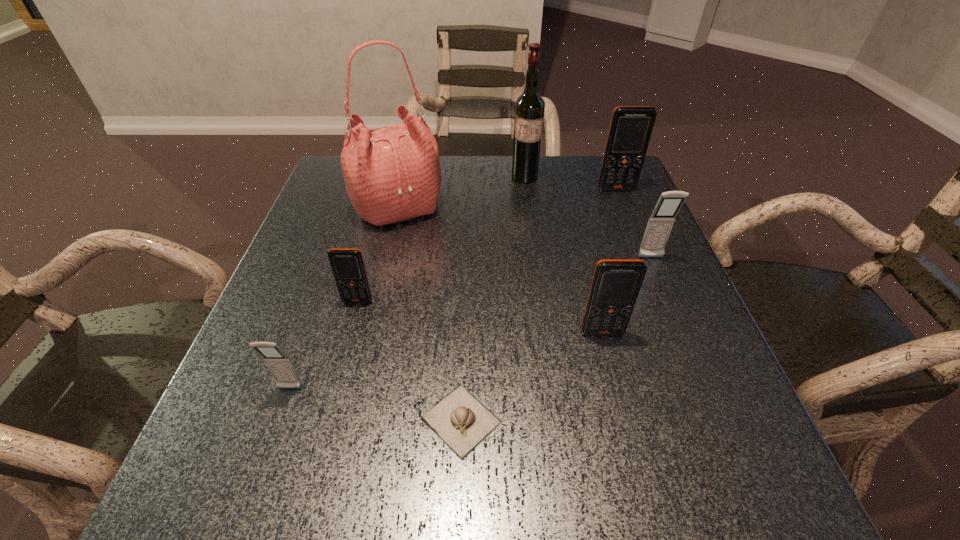
Identify the location of free space that is in between the rightmost orange cellular telephone and the leftmost cellular telephone. (453, 289).

This screenshot has width=960, height=540. In order to click on vacant area that lies between the nearest cellular telephone and the right gray cellular telephone in this screenshot , I will do `click(470, 323)`.

This screenshot has height=540, width=960. Identify the location of free space between the rightmost orange cellular telephone and the smallest orange cellular telephone. (487, 245).

Find the location of a particular element. The height and width of the screenshot is (540, 960). vacant space in between the fourth farthest object and the garlic is located at coordinates (556, 339).

Locate which object is the third closest to the bigger gray cellular telephone. Please provide its 2D coordinates. Your answer should be formatted as a tuple, i.e. [(x, y)], where the tuple contains the x and y coordinates of a point satisfying the conditions above.

[(529, 108)]

Locate which object ranks fifth in proximity to the bigger gray cellular telephone. Please provide its 2D coordinates. Your answer should be formatted as a tuple, i.e. [(x, y)], where the tuple contains the x and y coordinates of a point satisfying the conditions above.

[(392, 174)]

Select which cellular telephone appears as the closest to the smallest orange cellular telephone. Please provide its 2D coordinates. Your answer should be formatted as a tuple, i.e. [(x, y)], where the tuple contains the x and y coordinates of a point satisfying the conditions above.

[(280, 365)]

Where is `cellular telephone that is the third closest to the garlic`? The height and width of the screenshot is (540, 960). cellular telephone that is the third closest to the garlic is located at coordinates (347, 265).

Identify the location of orange cellular telephone that stands as the third closest to the garlic. (630, 130).

Find the location of a particular element. The height and width of the screenshot is (540, 960). orange cellular telephone that can be found as the closest to the handbag is located at coordinates (347, 265).